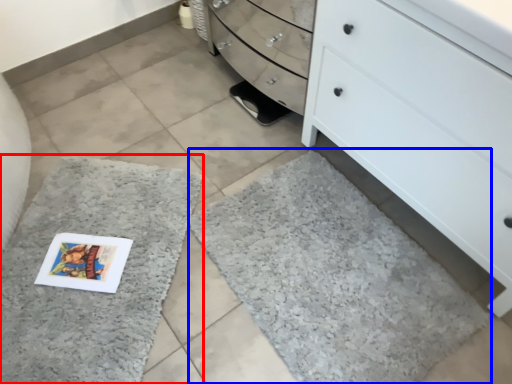
Question: Which point is closer to the camera, bath mat (highlighted by a red box) or bath mat (highlighted by a blue box)?

Choices:
 (A) bath mat
 (B) bath mat

Answer: (B)